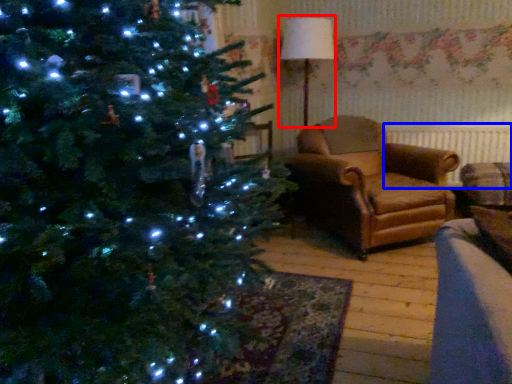
Question: Which object is closer to the camera taking this photo, lamp (highlighted by a red box) or radiator (highlighted by a blue box)?

Choices:
 (A) lamp
 (B) radiator

Answer: (A)